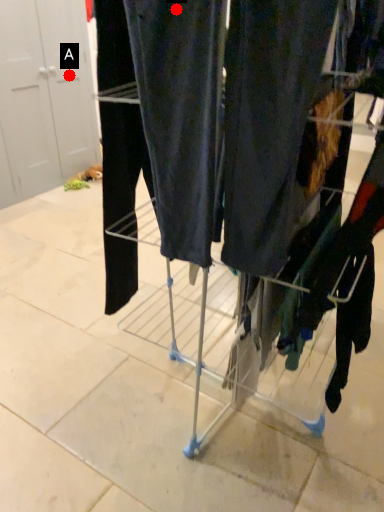
Question: Two points are circled on the image, labeled by A and B beside each circle. Which point is farther to the camera?

Choices:
 (A) A is further
 (B) B is further

Answer: (A)